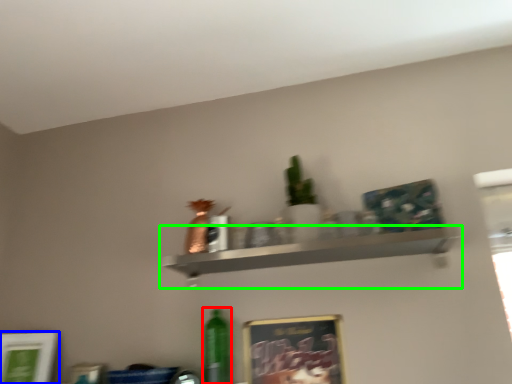
Question: Based on their relative distances, which object is nearer to bottle (highlighted by a red box)? Choose from picture frame (highlighted by a blue box) and shelf (highlighted by a green box).

Choices:
 (A) picture frame
 (B) shelf

Answer: (B)